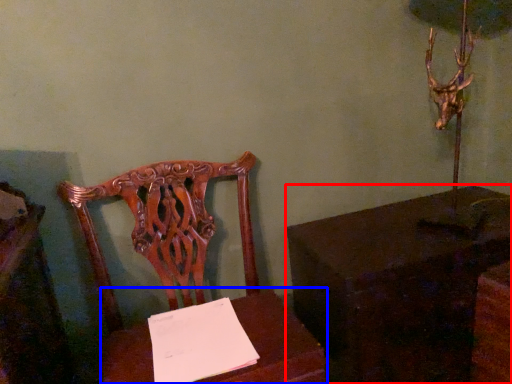
Question: Which object is closer to the camera taking this photo, table (highlighted by a red box) or table (highlighted by a blue box)?

Choices:
 (A) table
 (B) table

Answer: (B)